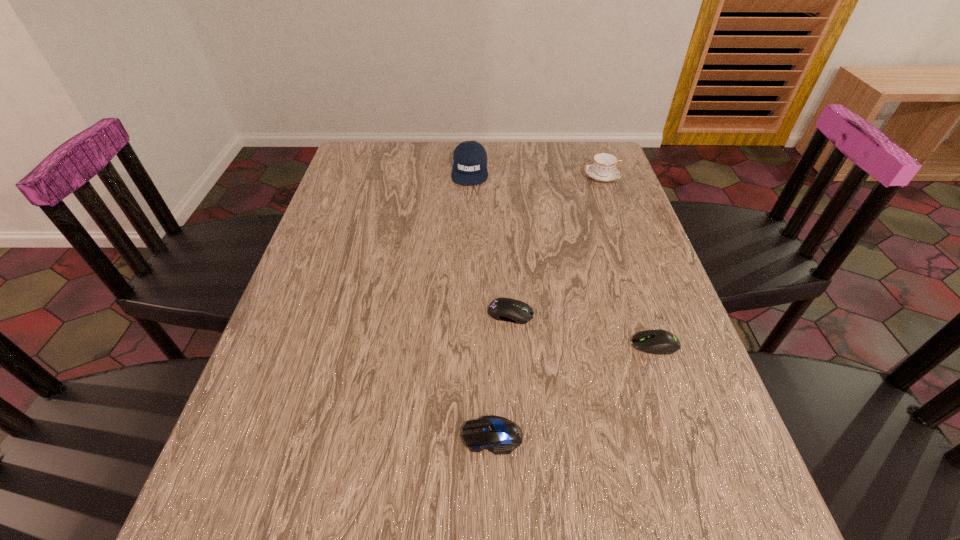
At what (x,y) coordinates should I click in order to perform the action: click on free point between the baseball cap and the fourth farthest object. Please return your answer as a coordinate pair (x, y). The image size is (960, 540). Looking at the image, I should click on (563, 257).

This screenshot has height=540, width=960. What are the coordinates of `free space between the farthest computer mouse and the second tallest object` in the screenshot? It's located at (556, 245).

This screenshot has width=960, height=540. I want to click on empty location between the third nearest object and the second nearest computer mouse, so click(x=583, y=329).

Where is `unoccupied area between the second nearest object and the nearest computer mouse`? This screenshot has height=540, width=960. unoccupied area between the second nearest object and the nearest computer mouse is located at coordinates (574, 390).

Identify which object is located as the second nearest to the rightmost computer mouse. Please provide its 2D coordinates. Your answer should be formatted as a tuple, i.e. [(x, y)], where the tuple contains the x and y coordinates of a point satisfying the conditions above.

[(499, 435)]

Locate which object is the second closest to the teacup. Please provide its 2D coordinates. Your answer should be formatted as a tuple, i.e. [(x, y)], where the tuple contains the x and y coordinates of a point satisfying the conditions above.

[(504, 309)]

Identify which computer mouse is the second closest to the teacup. Please provide its 2D coordinates. Your answer should be formatted as a tuple, i.e. [(x, y)], where the tuple contains the x and y coordinates of a point satisfying the conditions above.

[(661, 342)]

Locate an element on the screen. The width and height of the screenshot is (960, 540). computer mouse that is the closest to the fourth shortest object is located at coordinates (504, 309).